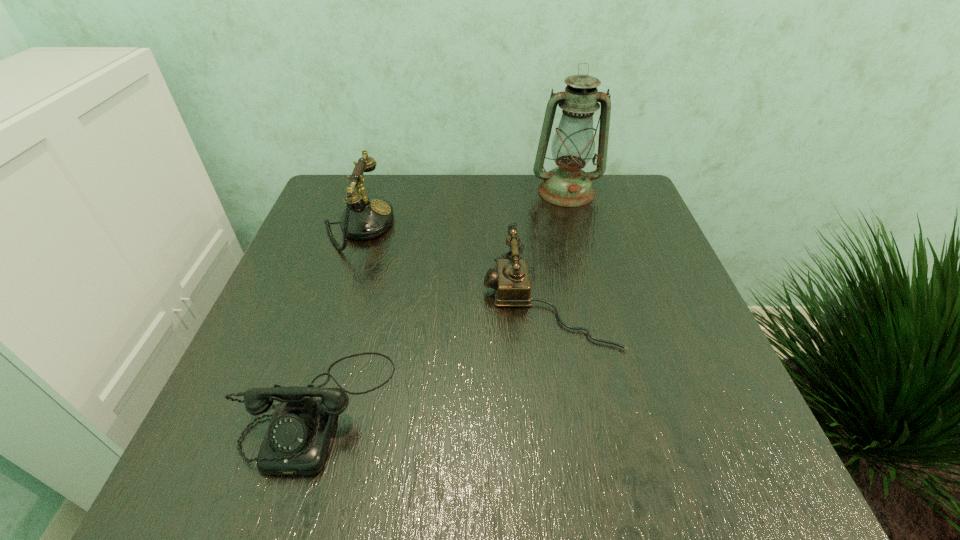
At what (x,y) coordinates should I click in order to perform the action: click on vacant space located on the dial of the second shortest object. Please return your answer as a coordinate pair (x, y). The width and height of the screenshot is (960, 540). Looking at the image, I should click on (375, 300).

Identify the location of vacant space located 0.090m on the dial of the second shortest object. (439, 300).

Find the location of a particular element. This screenshot has height=540, width=960. oil lamp situated at the far edge is located at coordinates (573, 145).

You are a GUI agent. You are given a task and a screenshot of the screen. Output one action in this format:
    pyautogui.click(x=<x>, y=<y>)
    Task: Click on the telephone at the far edge
    Image resolution: width=960 pixels, height=540 pixels.
    Given the screenshot: What is the action you would take?
    pyautogui.click(x=365, y=217)

Find the location of a particular element. object present at the near edge is located at coordinates (297, 439).

The width and height of the screenshot is (960, 540). What are the coordinates of `oil lamp that is at the right edge` in the screenshot? It's located at (573, 145).

I want to click on telephone positioned at the right edge, so click(x=511, y=281).

The image size is (960, 540). Find the location of `object that is at the far left corner`. object that is at the far left corner is located at coordinates (365, 217).

This screenshot has height=540, width=960. I want to click on object present at the near left corner, so click(x=297, y=439).

You are a GUI agent. You are given a task and a screenshot of the screen. Output one action in this format:
    pyautogui.click(x=<x>, y=<y>)
    Task: Click on the object at the far right corner
    This screenshot has height=540, width=960.
    Given the screenshot: What is the action you would take?
    pyautogui.click(x=573, y=145)